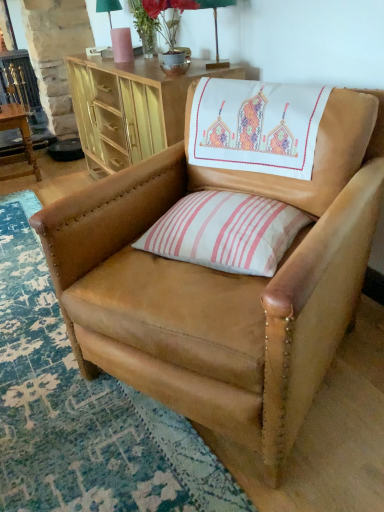
What do you see at coordinates (117, 32) in the screenshot? I see `green fabric lampshade at upper center, acting as the 2th table lamp starting from the bottom` at bounding box center [117, 32].

In order to face green fabric lampshade at upper center, which is the first table lamp in left-to-right order, should I rotate leftwards or rightwards?

To face it directly, rotate left by 11.105 degrees.

You are a GUI agent. You are given a task and a screenshot of the screen. Output one action in this format:
    pyautogui.click(x=<x>, y=<y>)
    Task: Click on the wooden table at lower left
    
    Given the screenshot: What is the action you would take?
    pyautogui.click(x=22, y=140)

This screenshot has height=512, width=384. What do you see at coordinates (214, 23) in the screenshot?
I see `green fabric table lamp at upper center, the 1th table lamp ordered from the bottom` at bounding box center [214, 23].

The width and height of the screenshot is (384, 512). What do you see at coordinates (130, 108) in the screenshot?
I see `matte gold desk at upper center` at bounding box center [130, 108].

Identify the location of tan leather chair at center. (223, 284).

In order to click on green fabric lampshade at upper center, arranged as the 1th table lamp when viewed from the top in this screenshot , I will do `click(117, 32)`.

In the image, is green fabric lampshade at upper center, acting as the 2th table lamp starting from the bottom, on the left side or the right side of green fabric table lamp at upper center, placed as the 2th table lamp when sorted from left to right?

green fabric lampshade at upper center, acting as the 2th table lamp starting from the bottom, is to the left of green fabric table lamp at upper center, placed as the 2th table lamp when sorted from left to right.

Between green fabric lampshade at upper center, which is the first table lamp in left-to-right order, and green fabric table lamp at upper center, placed as the 2th table lamp when sorted from left to right, which one has less height?

With less height is green fabric table lamp at upper center, placed as the 2th table lamp when sorted from left to right.

Between green fabric lampshade at upper center, which is counted as the second table lamp, starting from the right, and green fabric table lamp at upper center, the 1th table lamp ordered from the bottom, which one has smaller width?

Thinner between the two is green fabric lampshade at upper center, which is counted as the second table lamp, starting from the right.

Which of these two, green fabric lampshade at upper center, which is the first table lamp in left-to-right order, or green fabric table lamp at upper center, the 1th table lamp from the right, is bigger?

With larger size is green fabric lampshade at upper center, which is the first table lamp in left-to-right order.

Who is shorter, tan leather chair at center or matte gold desk at upper center?

Answer: With less height is matte gold desk at upper center.

Is tan leather chair at center not within matte gold desk at upper center?

Yes, tan leather chair at center is outside of matte gold desk at upper center.

From a real-world perspective, is tan leather chair at center above or below matte gold desk at upper center?

In terms of real-world spatial position, tan leather chair at center is above matte gold desk at upper center.

Would you consider tan leather chair at center to be distant from matte gold desk at upper center?

No, tan leather chair at center is in close proximity to matte gold desk at upper center.

Does wooden table at lower left lie in front of tan leather chair at center?

No, it is not.

From the picture: Is wooden table at lower left located outside tan leather chair at center?

Indeed, wooden table at lower left is completely outside tan leather chair at center.

Considering the relative sizes of wooden table at lower left and tan leather chair at center in the image provided, is wooden table at lower left bigger than tan leather chair at center?

No, wooden table at lower left is not bigger than tan leather chair at center.

Considering the points (32, 146) and (318, 152), which point is in front, point (32, 146) or point (318, 152)?

Positioned in front is point (318, 152).

From the image's perspective, who appears lower, green fabric lampshade at upper center, which is the 2th table lamp in front-to-back order, or wooden table at lower left?

From the image's view, wooden table at lower left is below.

From the picture: Can you see green fabric lampshade at upper center, which is counted as the second table lamp, starting from the right, touching wooden table at lower left?

green fabric lampshade at upper center, which is counted as the second table lamp, starting from the right, and wooden table at lower left are clearly separated.

Would you say green fabric lampshade at upper center, which is counted as the second table lamp, starting from the right, contains wooden table at lower left?

No, wooden table at lower left is not surrounded by green fabric lampshade at upper center, which is counted as the second table lamp, starting from the right.

Can you confirm if matte gold desk at upper center is wider than wooden table at lower left?

Yes, matte gold desk at upper center is wider than wooden table at lower left.

Who is bigger, matte gold desk at upper center or wooden table at lower left?

matte gold desk at upper center is bigger.

How many degrees apart are the facing directions of matte gold desk at upper center and wooden table at lower left?

4.01 degrees separate the facing orientations of matte gold desk at upper center and wooden table at lower left.

From a real-world perspective, is matte gold desk at upper center beneath wooden table at lower left?

No, from a real-world perspective, matte gold desk at upper center is not under wooden table at lower left.

Consider the image. Does pink striped fabric pillow at center touch green fabric table lamp at upper center, the 2th table lamp viewed from the top?

No, pink striped fabric pillow at center is not with green fabric table lamp at upper center, the 2th table lamp viewed from the top.

Which of these two, pink striped fabric pillow at center or green fabric table lamp at upper center, the 1th table lamp ordered from the bottom, stands shorter?

Standing shorter between the two is pink striped fabric pillow at center.

Considering the relative positions of pink striped fabric pillow at center and green fabric table lamp at upper center, placed as the first table lamp when sorted from front to back, in the image provided, is pink striped fabric pillow at center to the left of green fabric table lamp at upper center, placed as the first table lamp when sorted from front to back, from the viewer's perspective?

Yes.

Does pink striped fabric pillow at center lie in front of green fabric table lamp at upper center, placed as the 2th table lamp when sorted from left to right?

Yes, pink striped fabric pillow at center is in front of green fabric table lamp at upper center, placed as the 2th table lamp when sorted from left to right.

In the scene shown: Which object is positioned more to the right, tan leather chair at center or green fabric table lamp at upper center, the second table lamp in the back-to-front sequence?

tan leather chair at center.

Is tan leather chair at center wider than green fabric table lamp at upper center, the 1th table lamp from the right?

Yes, tan leather chair at center is wider than green fabric table lamp at upper center, the 1th table lamp from the right.

Is tan leather chair at center looking in the opposite direction of green fabric table lamp at upper center, the 1th table lamp from the right?

Absolutely, tan leather chair at center is directed away from green fabric table lamp at upper center, the 1th table lamp from the right.

At what (x,y) coordinates should I click in order to perform the action: click on table lamp above the green fabric table lamp at upper center, the 1th table lamp from the right (from a real-world perspective). Please return your answer as a coordinate pair (x, y). The width and height of the screenshot is (384, 512). Looking at the image, I should click on (117, 32).

Identify the location of desk above the tan leather chair at center (from the image's perspective). (130, 108).

When comparing their distances from green fabric table lamp at upper center, the 2th table lamp viewed from the top, does matte gold desk at upper center or wooden table at lower left seem further?

Among the two, wooden table at lower left is located further to green fabric table lamp at upper center, the 2th table lamp viewed from the top.

Estimate the real-world distances between objects in this image. Which object is closer to green fabric lampshade at upper center, which is counted as the first table lamp, starting from the back, wooden table at lower left or matte gold desk at upper center?

matte gold desk at upper center is positioned closer to the anchor green fabric lampshade at upper center, which is counted as the first table lamp, starting from the back.

Estimate the real-world distances between objects in this image. Which object is further from matte gold desk at upper center, green fabric table lamp at upper center, placed as the first table lamp when sorted from front to back, or tan leather chair at center?

The object further to matte gold desk at upper center is tan leather chair at center.

Considering their positions, is tan leather chair at center positioned closer to wooden table at lower left than green fabric lampshade at upper center, arranged as the 1th table lamp when viewed from the top?

Based on the image, green fabric lampshade at upper center, arranged as the 1th table lamp when viewed from the top, appears to be nearer to wooden table at lower left.

Based on their spatial positions, is matte gold desk at upper center or tan leather chair at center further from wooden table at lower left?

tan leather chair at center.

Which object lies nearer to the anchor point wooden table at lower left, tan leather chair at center or pink striped fabric pillow at center?

Based on the image, pink striped fabric pillow at center appears to be nearer to wooden table at lower left.

Consider the image. When comparing their distances from green fabric table lamp at upper center, the second table lamp in the back-to-front sequence, does tan leather chair at center or matte gold desk at upper center seem further?

tan leather chair at center is further to green fabric table lamp at upper center, the second table lamp in the back-to-front sequence.

Considering their positions, is green fabric table lamp at upper center, the 1th table lamp ordered from the bottom, positioned further to green fabric lampshade at upper center, which is counted as the second table lamp, starting from the right, than matte gold desk at upper center?

Among the two, green fabric table lamp at upper center, the 1th table lamp ordered from the bottom, is located further to green fabric lampshade at upper center, which is counted as the second table lamp, starting from the right.

Identify the location of pillow between tan leather chair at center and green fabric lampshade at upper center, acting as the 2th table lamp starting from the bottom, along the z-axis. pos(226,232).

What are the coordinates of `table lamp between wooden table at lower left and green fabric table lamp at upper center, placed as the first table lamp when sorted from front to back, in the horizontal direction` in the screenshot? It's located at (117, 32).

Locate an element on the screen. This screenshot has height=512, width=384. desk located between pink striped fabric pillow at center and wooden table at lower left in the depth direction is located at coordinates (130, 108).

At what (x,y) coordinates should I click in order to perform the action: click on desk between tan leather chair at center and green fabric table lamp at upper center, the 2th table lamp viewed from the top, from front to back. Please return your answer as a coordinate pair (x, y). The image size is (384, 512). Looking at the image, I should click on (130, 108).